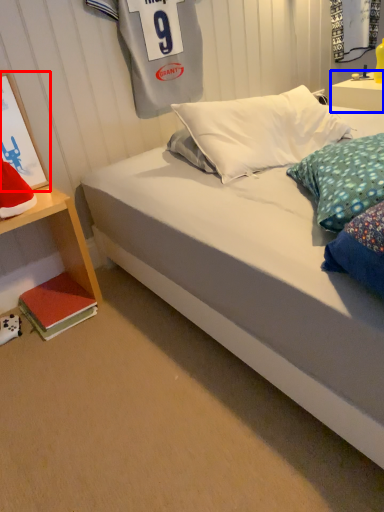
Question: Which object appears closest to the camera in this image, picture frame (highlighted by a red box) or nightstand (highlighted by a blue box)?

Choices:
 (A) picture frame
 (B) nightstand

Answer: (A)